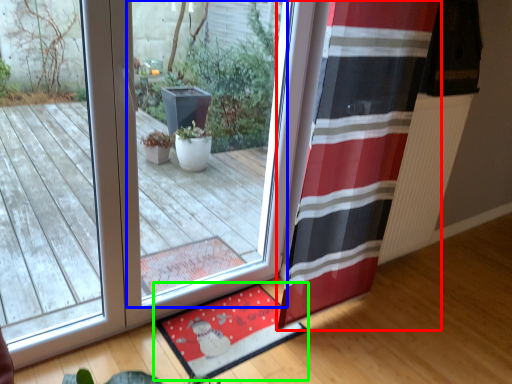
Question: Considering the real-world distances, which object is closest to curtain (highlighted by a red box)? window (highlighted by a blue box) or mat (highlighted by a green box).

Choices:
 (A) window
 (B) mat

Answer: (B)